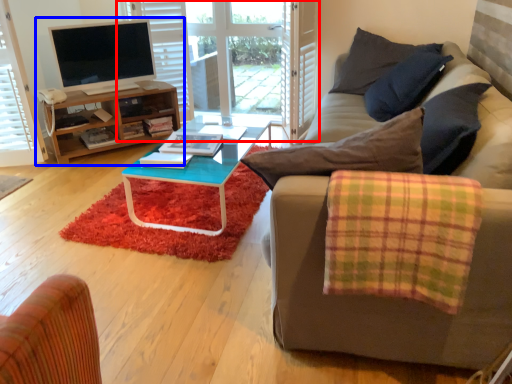
Question: Which of the following is the closest to the observer, glass door (highlighted by a red box) or entertainment center (highlighted by a blue box)?

Choices:
 (A) glass door
 (B) entertainment center

Answer: (B)